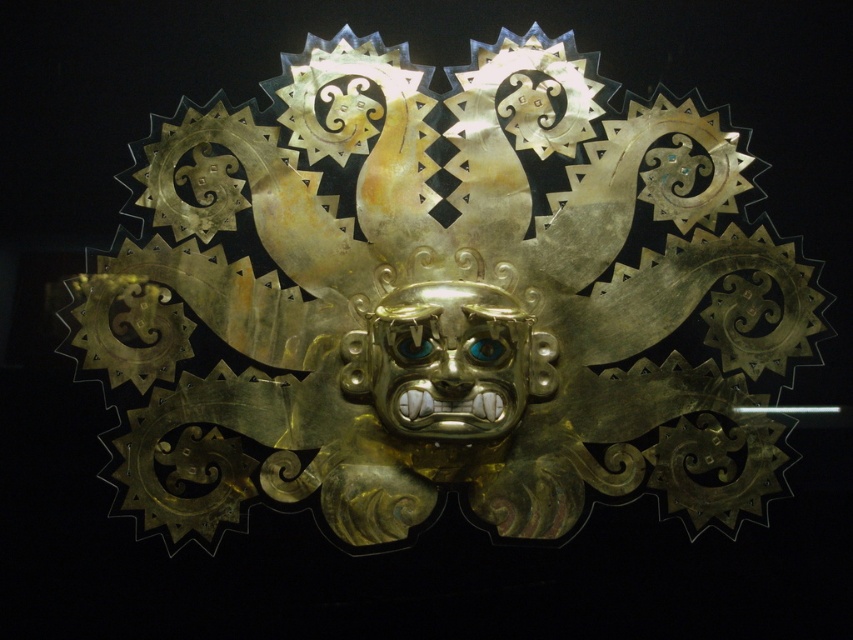
You are an archaeologist examining the golden artifact. You notice a specific point at coordinates (450, 360). According to the artifact description, where is this point located?

The point at (450, 360) is on the gold metallic mask at center.